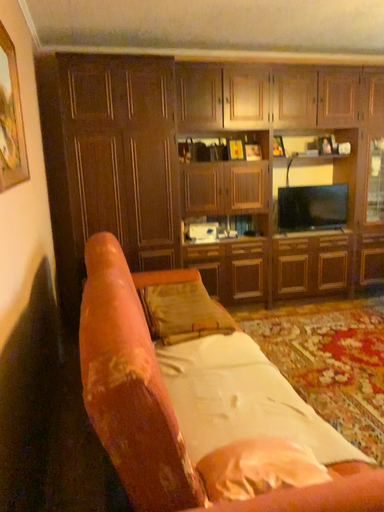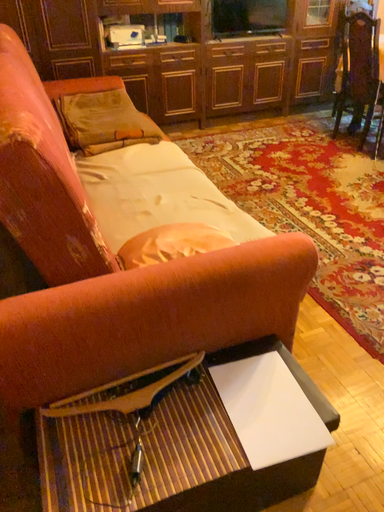
Question: How did the camera likely rotate when shooting the video?

Choices:
 (A) rotated right
 (B) rotated left

Answer: (A)